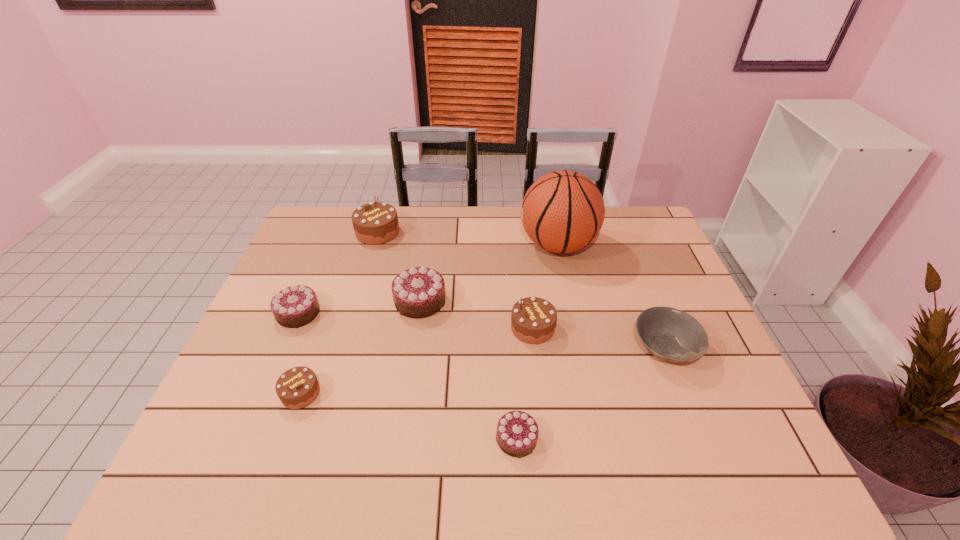
This screenshot has width=960, height=540. I want to click on the seventh farthest object, so click(298, 387).

Identify the location of the rightmost object. This screenshot has width=960, height=540. (670, 334).

The height and width of the screenshot is (540, 960). In order to click on gray bowl in this screenshot , I will do `click(670, 334)`.

Where is `the smallest chocolate chocolate cake`? the smallest chocolate chocolate cake is located at coordinates pos(517,432).

Where is `the shortest chocolate cake`? The height and width of the screenshot is (540, 960). the shortest chocolate cake is located at coordinates (517, 432).

This screenshot has width=960, height=540. In order to click on free region located on the side where the inflation valve is located in this screenshot , I will do `click(425, 245)`.

What are the coordinates of `vacant space located 0.080m on the side where the inflation valve is located` in the screenshot? It's located at (494, 245).

At what (x,y) coordinates should I click in order to perform the action: click on vacant space located 0.400m on the side where the inflation valve is located. Please return your answer as a coordinate pair (x, y). Looking at the image, I should click on (398, 245).

This screenshot has width=960, height=540. In order to click on free location located on the right of the tallest chocolate cake in this screenshot , I will do `click(480, 232)`.

At what (x,y) coordinates should I click in order to perform the action: click on vacant region located 0.280m on the front of the third chocolate cake from right to left. Please return your answer as a coordinate pair (x, y). Looking at the image, I should click on (404, 411).